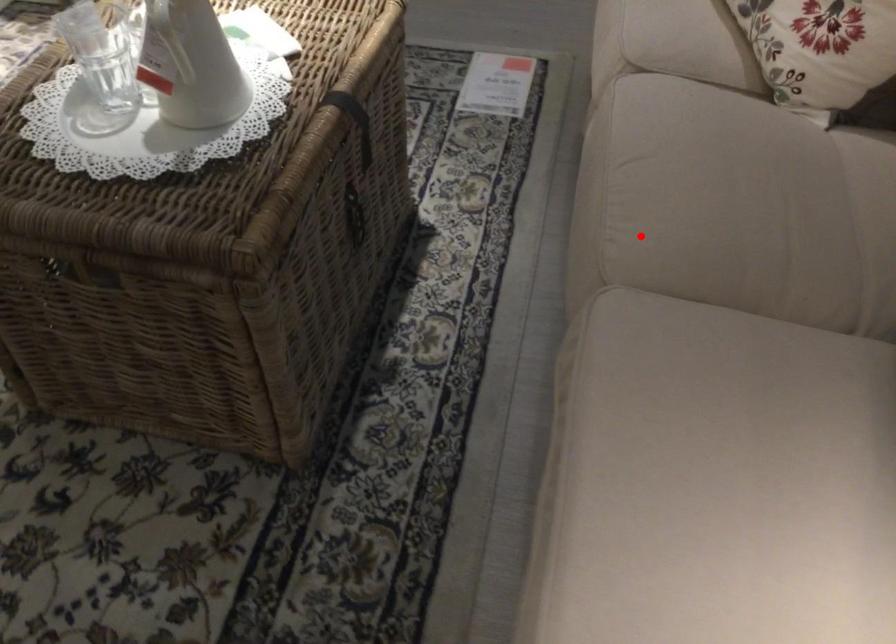
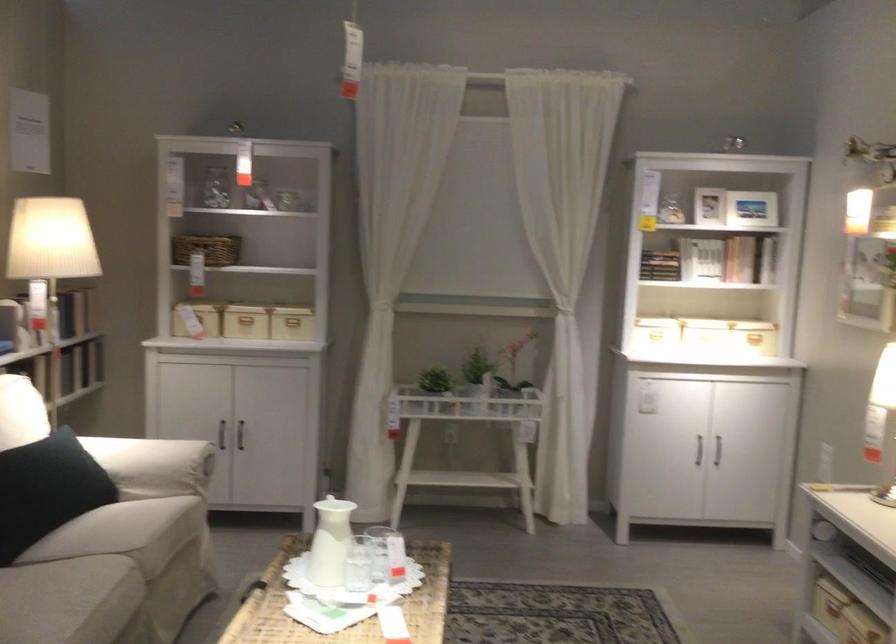
Question: I am providing you with two images of the same scene from different viewpoints. Image1 has a red point marked. In image2, the corresponding 3D location appears at what relative position? Reply with the corresponding letter.

Choices:
 (A) Closer
 (B) Farther

Answer: (B)